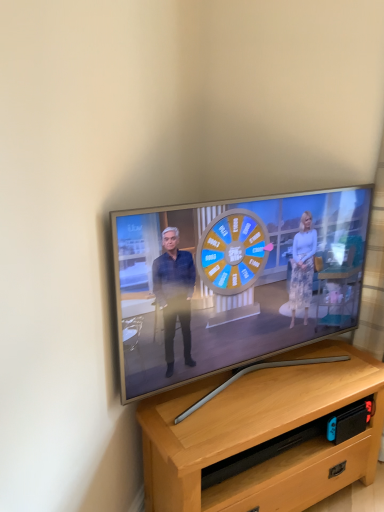
Question: Is light brown wood desk at center outside of matte silver tv at center?

Choices:
 (A) yes
 (B) no

Answer: (A)

Question: Is light brown wood desk at center at the left side of matte silver tv at center?

Choices:
 (A) yes
 (B) no

Answer: (B)

Question: Is matte silver tv at center inside light brown wood desk at center?

Choices:
 (A) no
 (B) yes

Answer: (A)

Question: Is light brown wood desk at center oriented away from matte silver tv at center?

Choices:
 (A) no
 (B) yes

Answer: (A)

Question: Is light brown wood desk at center further to camera compared to matte silver tv at center?

Choices:
 (A) no
 (B) yes

Answer: (B)

Question: Is light brown wood desk at center touching matte silver tv at center?

Choices:
 (A) yes
 (B) no

Answer: (B)

Question: Considering the relative sizes of matte silver tv at center and light brown wood desk at center in the image provided, is matte silver tv at center smaller than light brown wood desk at center?

Choices:
 (A) no
 (B) yes

Answer: (B)

Question: Is the depth of matte silver tv at center greater than that of light brown wood desk at center?

Choices:
 (A) no
 (B) yes

Answer: (A)

Question: From a real-world perspective, is matte silver tv at center over light brown wood desk at center?

Choices:
 (A) yes
 (B) no

Answer: (A)

Question: Is matte silver tv at center turned away from light brown wood desk at center?

Choices:
 (A) yes
 (B) no

Answer: (B)

Question: From a real-world perspective, is matte silver tv at center below light brown wood desk at center?

Choices:
 (A) yes
 (B) no

Answer: (B)

Question: Can you confirm if matte silver tv at center is bigger than light brown wood desk at center?

Choices:
 (A) yes
 (B) no

Answer: (B)

Question: In terms of width, does matte silver tv at center look wider or thinner when compared to light brown wood desk at center?

Choices:
 (A) wide
 (B) thin

Answer: (B)